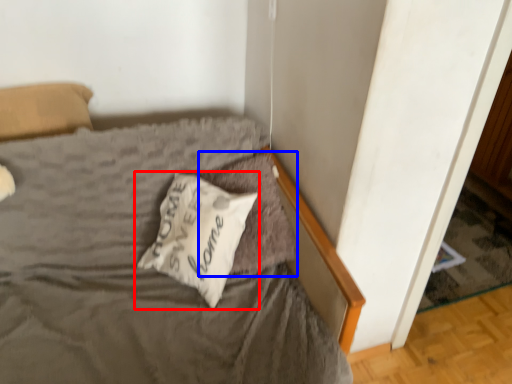
Question: Which of the following is the closest to the observer, pillow (highlighted by a red box) or pillow (highlighted by a blue box)?

Choices:
 (A) pillow
 (B) pillow

Answer: (A)